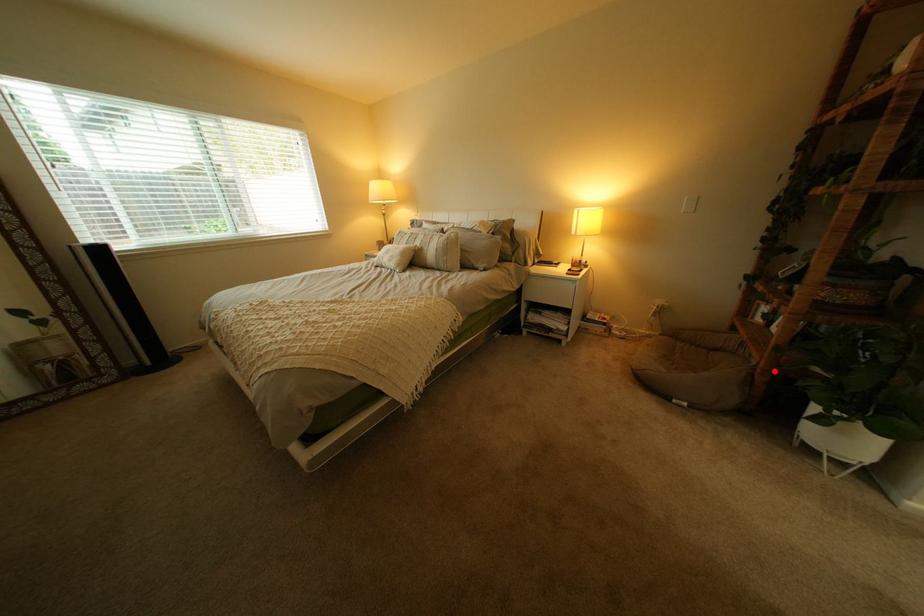
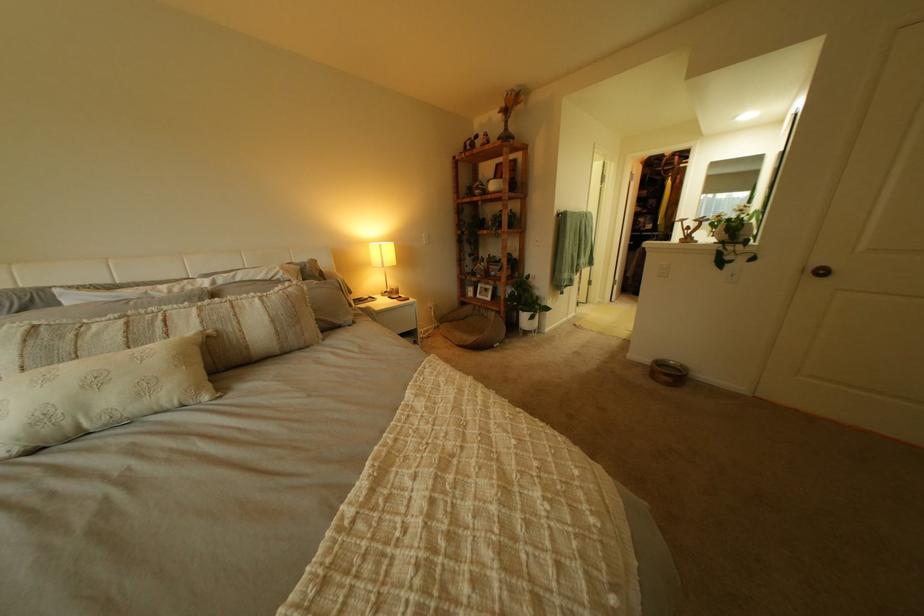
Locate, in the second image, the point that corresponds to the highlighted location in the first image.

(517, 314)